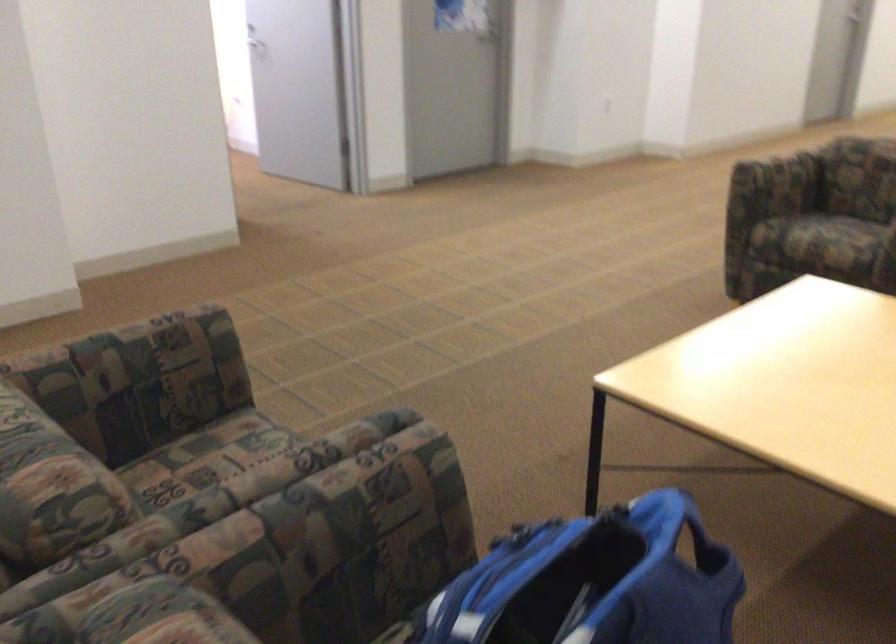
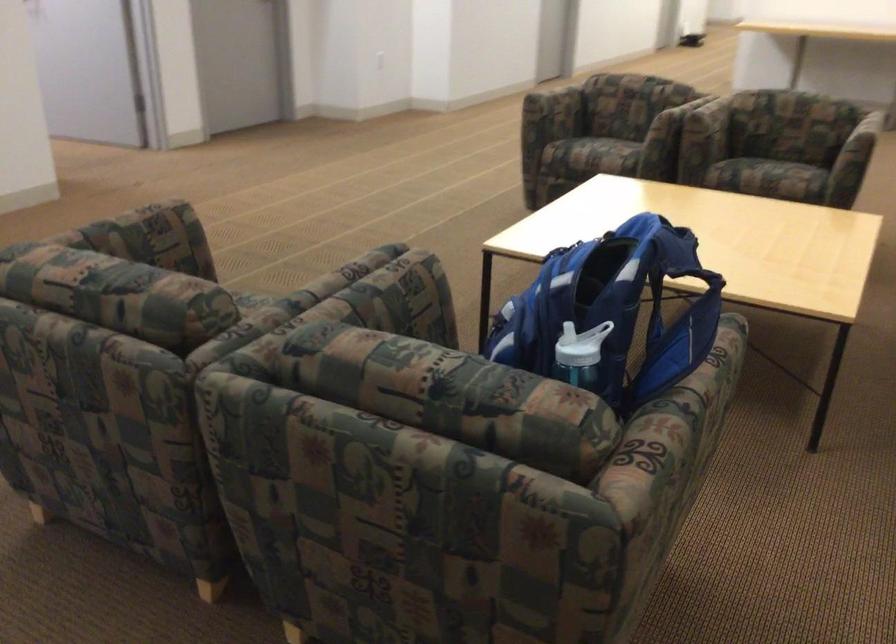
Locate, in the second image, the point that corresponds to the point at 817,243 in the first image.

(597, 152)